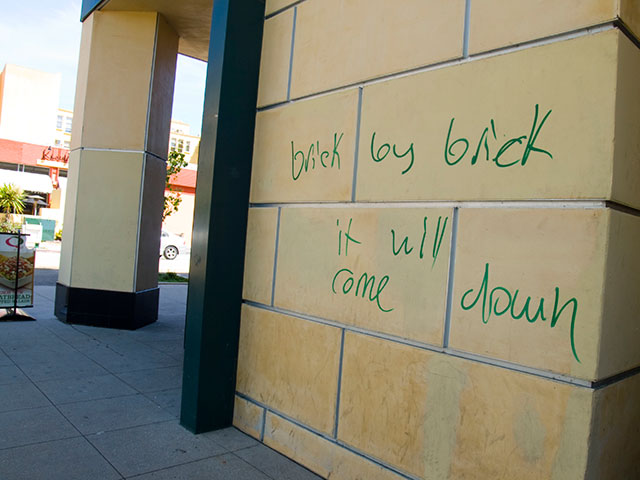
At what (x,y) coordinates should I click in order to perform the action: click on pillar. Please return your answer as a coordinate pair (x, y). Looking at the image, I should click on (128, 180).